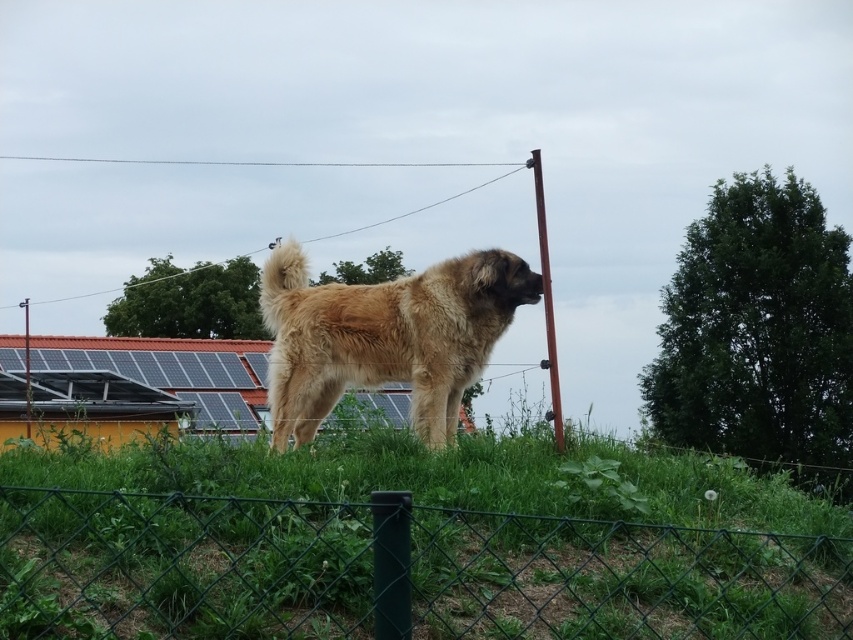
Is point (381, 624) behind point (442, 304)?

No, (381, 624) is in front of (442, 304).

Between point (53, 541) and point (396, 294), which one is positioned in front?

Positioned in front is point (53, 541).

I want to click on green wire mesh fence at lower center, so click(x=396, y=572).